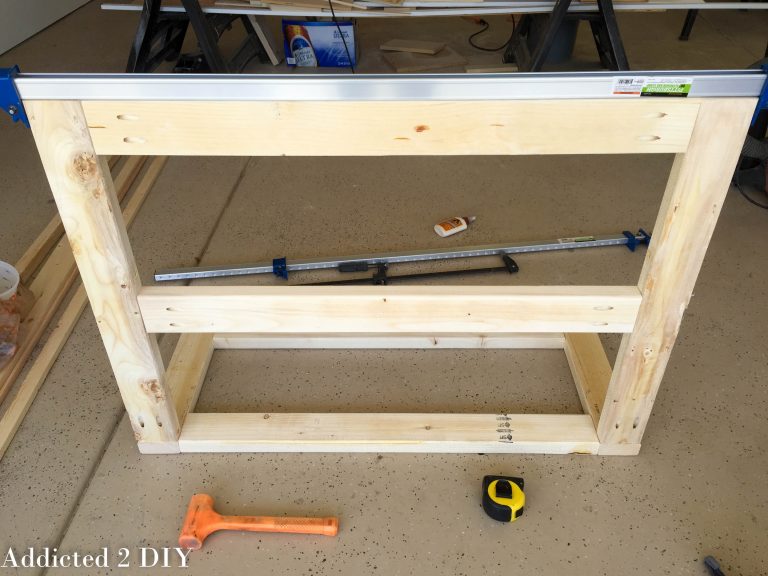
I want to click on concrete floor, so click(717, 450).